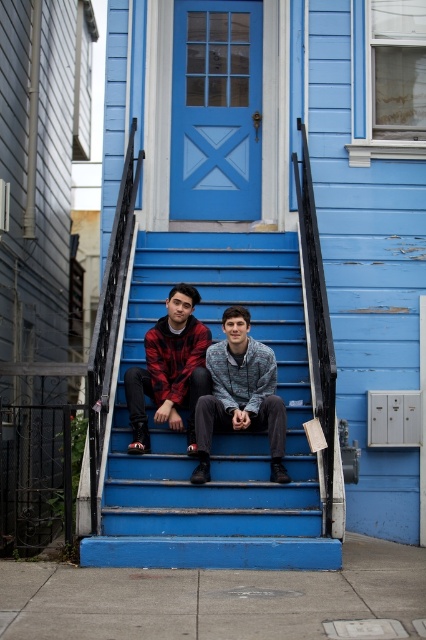
Looking at this image, you are standing in front of the house and want to take a photo of both the blue matte stairs at center and the red plaid shirt at center. Since you can only focus on one object at a time, which one should you focus on to ensure the other is still in the background?

You should focus on the blue matte stairs at center because it is closer to you, and the red plaid shirt at center will naturally appear in the background.

You are trying to determine if the blue matte stairs at center can accommodate placing a large potted plant that is as wide as the red plaid shirt at center. Based on the scene, is there enough space?

The blue matte stairs at center might be wider than red plaid shirt at center, so there is likely enough space to place the potted plant.